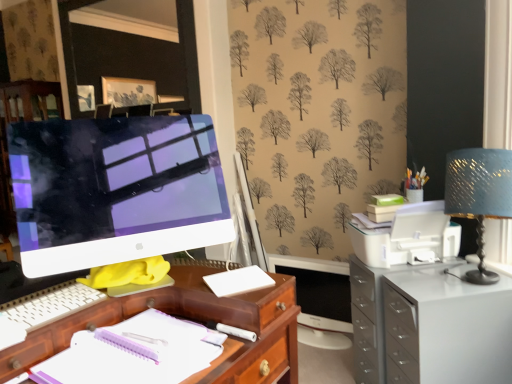
You are a GUI agent. You are given a task and a screenshot of the screen. Output one action in this format:
    pyautogui.click(x=<x>, y=<y>)
    Task: Click on the empty space that is ontop of white glossy filing cabinet at right (from a real-world perspective)
    The width and height of the screenshot is (512, 384).
    Given the screenshot: What is the action you would take?
    pyautogui.click(x=438, y=285)